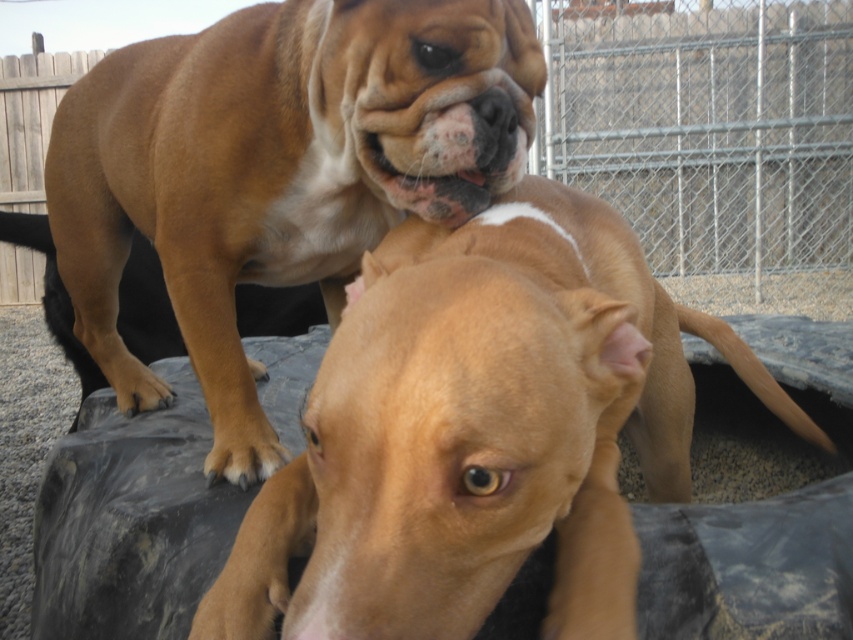
You are a photographer setting up a tripod to take a portrait of both the smooth tan dog at center and the brown matte dog at center. Which dog should you position closer to the camera to ensure both are in focus?

The smooth tan dog at center is shorter than the brown matte dog at center, so you should position the smooth tan dog at center closer to the camera to ensure both are in focus.

You are a dog trainer trying to separate two dogs. The smooth tan dog at center and the brown matte dog at center are too close. You have a divider that is 40 centimeters wide. Can you place it between them to separate them?

The distance between the smooth tan dog at center and the brown matte dog at center is 42.44 centimeters. Since the divider is 40 centimeters wide, it can be placed between them as the distance is greater than the divider width.

You are a photographer trying to capture both the smooth tan dog at center and the brown matte dog at center in a single shot. Given their positions, which dog will appear closer to the camera in the photo?

The smooth tan dog at center is positioned under the brown matte dog at center, so the brown matte dog at center will appear closer to the camera in the photo.